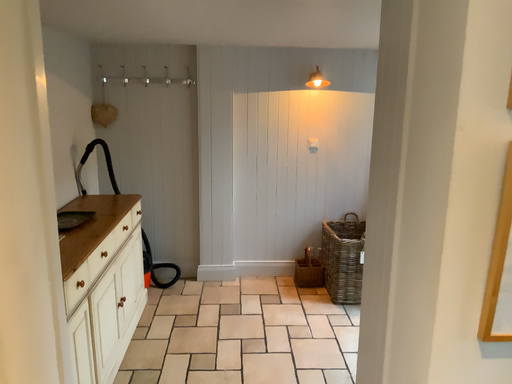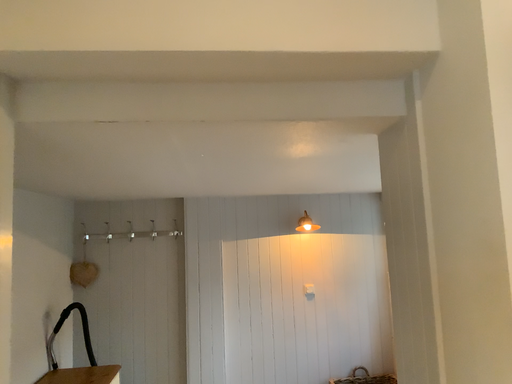
Question: Which way did the camera rotate in the video?

Choices:
 (A) rotated downward
 (B) rotated upward

Answer: (B)